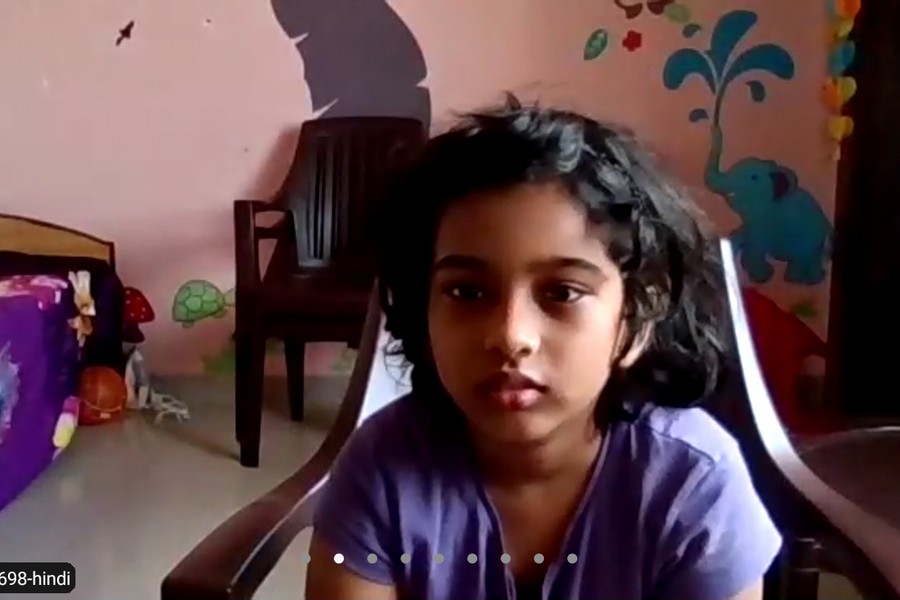
Locate an element on the screen. brown wood chair back is located at coordinates (317, 217).